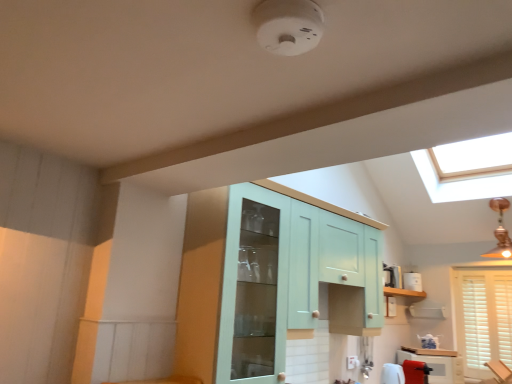
Question: From their relative heights in the image, would you say light teal glass cabinet at center, the first cabinetry from the top, is taller or shorter than white plastic toaster at right?

Choices:
 (A) short
 (B) tall

Answer: (B)

Question: From the image's perspective, relative to white plastic toaster at right, is light teal glass cabinet at center, marked as the first cabinetry in a front-to-back arrangement, above or below?

Choices:
 (A) below
 (B) above

Answer: (B)

Question: Based on their relative distances, which object is nearer to the white glossy counter top at lower right?

Choices:
 (A) light teal glass cabinet at center, marked as the first cabinetry in a front-to-back arrangement
 (B) matte white cabinet at lower right, which is the first cabinetry from right to left
 (C) white wooden blinds at lower right
 (D) white plastic toaster at right

Answer: (B)

Question: Which is nearer to the white glossy counter top at lower right?

Choices:
 (A) white wooden blinds at lower right
 (B) light teal glass cabinet at center, the first cabinetry from the top
 (C) white plastic toaster at right
 (D) matte white cabinet at lower right, the 1th cabinetry viewed from the back

Answer: (D)